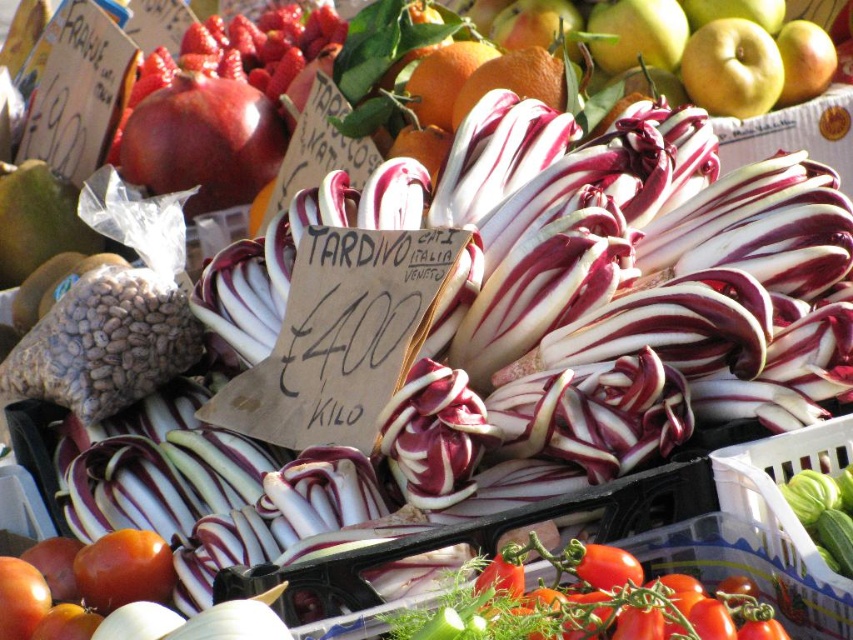
Is shiny red pomegranate at upper left taller than smooth green apple at upper right?

Yes, shiny red pomegranate at upper left is taller than smooth green apple at upper right.

Image resolution: width=853 pixels, height=640 pixels. Find the location of `shiny red pomegranate at upper left`. shiny red pomegranate at upper left is located at coordinates (202, 141).

What do you see at coordinates (202, 141) in the screenshot?
I see `shiny red pomegranate at upper left` at bounding box center [202, 141].

Where is `shiny red pomegranate at upper left`? The image size is (853, 640). shiny red pomegranate at upper left is located at coordinates (202, 141).

Can you confirm if shiny red pomegranate at upper left is positioned to the left of glossy red tomato at lower left?

Indeed, shiny red pomegranate at upper left is positioned on the left side of glossy red tomato at lower left.

Does shiny red pomegranate at upper left come behind glossy red tomato at lower left?

Yes.

Is point (180, 109) positioned after point (13, 598)?

Yes, it is behind point (13, 598).

Locate an element on the screen. Image resolution: width=853 pixels, height=640 pixels. shiny red pomegranate at upper left is located at coordinates (202, 141).

This screenshot has width=853, height=640. What do you see at coordinates (202, 141) in the screenshot?
I see `shiny red pomegranate at upper left` at bounding box center [202, 141].

Image resolution: width=853 pixels, height=640 pixels. In order to click on shiny red pomegranate at upper left in this screenshot , I will do `click(202, 141)`.